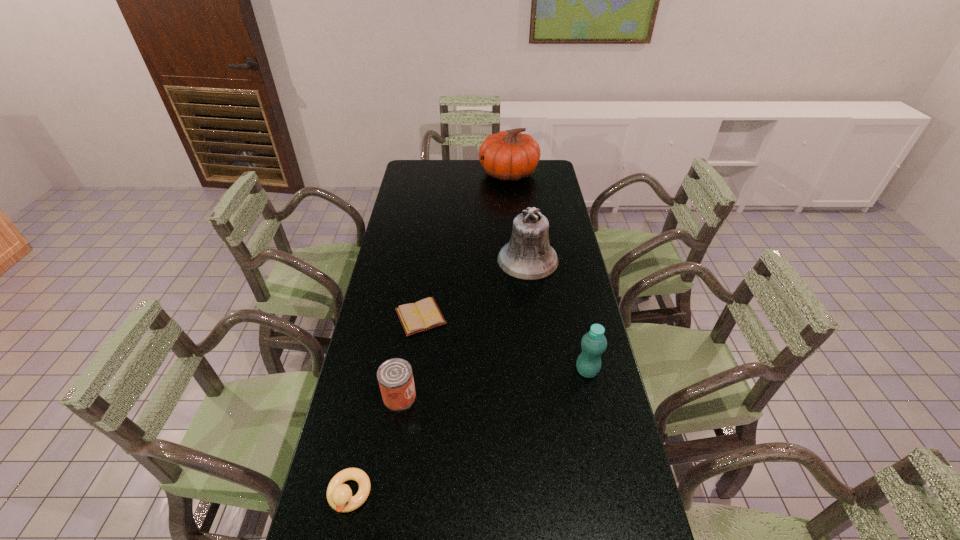
The height and width of the screenshot is (540, 960). In order to click on vacant region located 0.100m on the face of the farthest object in this screenshot , I will do `click(459, 173)`.

This screenshot has height=540, width=960. Find the location of `free space located on the face of the farthest object`. free space located on the face of the farthest object is located at coordinates (465, 173).

Where is `free space located 0.240m on the face of the farthest object`? The image size is (960, 540). free space located 0.240m on the face of the farthest object is located at coordinates (430, 173).

The image size is (960, 540). What are the coordinates of `blank space located 0.060m on the back of the fifth nearest object` in the screenshot? It's located at click(524, 232).

The width and height of the screenshot is (960, 540). Find the location of `free location located 0.340m at the front cap of the fourth farthest object`. free location located 0.340m at the front cap of the fourth farthest object is located at coordinates (459, 371).

The width and height of the screenshot is (960, 540). In order to click on vacant space located at the front cap of the fourth farthest object in this screenshot , I will do `click(456, 371)`.

Where is `vacant space located at the front cap of the fourth farthest object`? Image resolution: width=960 pixels, height=540 pixels. vacant space located at the front cap of the fourth farthest object is located at coordinates (551, 371).

Locate an element on the screen. The width and height of the screenshot is (960, 540). free location located on the back of the third shortest object is located at coordinates (416, 295).

In order to click on free point located on the right of the third farthest object in this screenshot , I will do `click(560, 317)`.

Where is `object located in the far edge section of the desktop`? object located in the far edge section of the desktop is located at coordinates (509, 156).